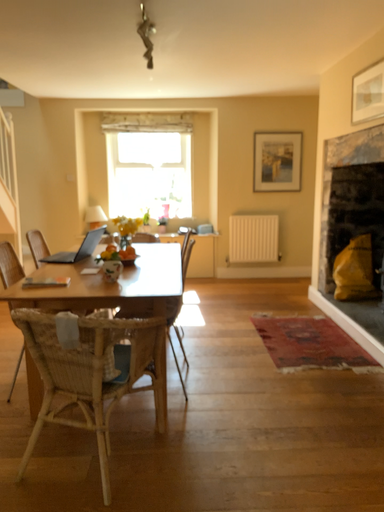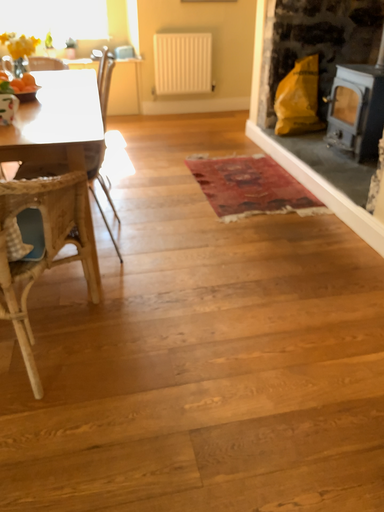
Question: Which way did the camera rotate in the video?

Choices:
 (A) rotated downward
 (B) rotated upward

Answer: (A)